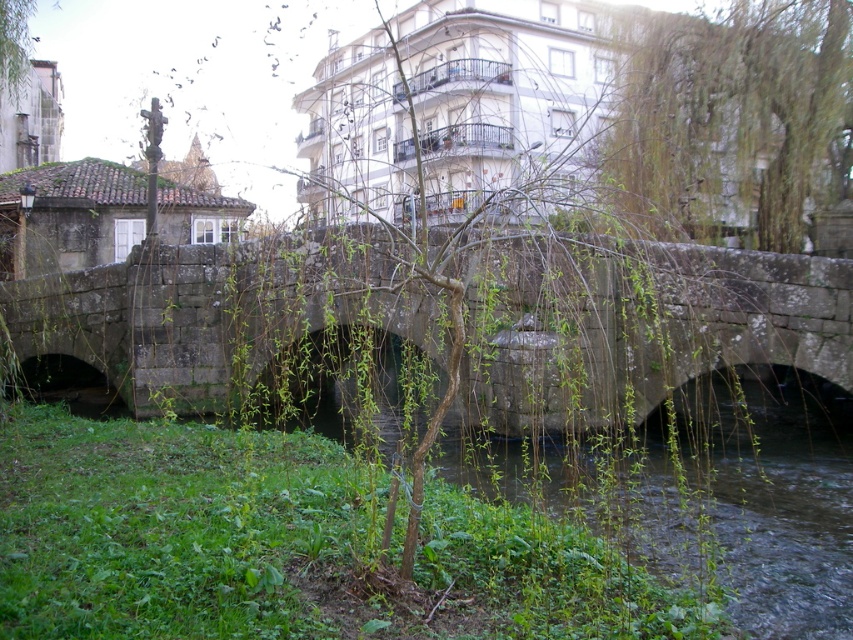
You are a bird flying over the urban scene. You want to land on the stone bridge at center to rest. However, you notice the green leafy tree at upper right nearby. Which direction should you fly to reach the bridge from the tree?

The stone bridge at center is below the green leafy tree at upper right, so you should fly downward from the tree to reach the bridge.

Looking at this image, you are standing at the base of the stone bridge and want to walk towards the point that is closer to you. Which point should you head towards, point (x=622, y=396) or point (x=750, y=136)?

You should head towards point (x=622, y=396) because it is closer to the viewer than point (x=750, y=136).